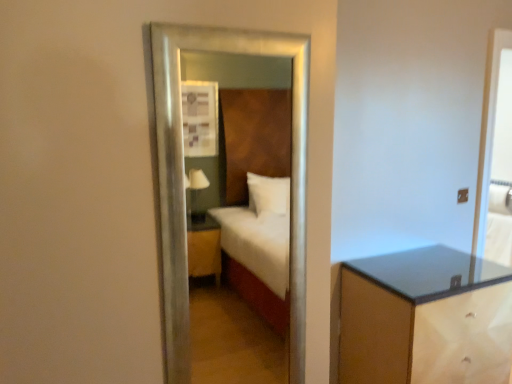
Question: Does clear glass screen door at right have a greater height compared to matte brown nightstand at lower right?

Choices:
 (A) no
 (B) yes

Answer: (B)

Question: Is clear glass screen door at right positioned far away from matte brown nightstand at lower right?

Choices:
 (A) yes
 (B) no

Answer: (B)

Question: Is clear glass screen door at right turned away from matte brown nightstand at lower right?

Choices:
 (A) yes
 (B) no

Answer: (B)

Question: Is the position of clear glass screen door at right less distant than that of matte brown nightstand at lower right?

Choices:
 (A) no
 (B) yes

Answer: (A)

Question: From the image's perspective, is clear glass screen door at right located above matte brown nightstand at lower right?

Choices:
 (A) no
 (B) yes

Answer: (B)

Question: In the image, is clear glass screen door at right positioned in front of or behind silver metallic mirror at center?

Choices:
 (A) front
 (B) behind

Answer: (B)

Question: From a real-world perspective, is clear glass screen door at right physically located above or below silver metallic mirror at center?

Choices:
 (A) below
 (B) above

Answer: (B)

Question: Is clear glass screen door at right inside the boundaries of silver metallic mirror at center, or outside?

Choices:
 (A) outside
 (B) inside

Answer: (A)

Question: Based on their positions, is clear glass screen door at right located to the left or right of silver metallic mirror at center?

Choices:
 (A) left
 (B) right

Answer: (B)

Question: From their relative heights in the image, would you say clear glass screen door at right is taller or shorter than matte brown nightstand at lower right?

Choices:
 (A) short
 (B) tall

Answer: (B)

Question: Does point (500, 153) appear closer or farther from the camera than point (492, 269)?

Choices:
 (A) farther
 (B) closer

Answer: (A)

Question: From a real-world perspective, is clear glass screen door at right positioned above or below matte brown nightstand at lower right?

Choices:
 (A) below
 (B) above

Answer: (B)

Question: Considering the relative positions of clear glass screen door at right and matte brown nightstand at lower right in the image provided, is clear glass screen door at right to the left or to the right of matte brown nightstand at lower right?

Choices:
 (A) right
 (B) left

Answer: (A)

Question: From a real-world perspective, is silver metallic mirror at center positioned above or below matte brown nightstand at lower right?

Choices:
 (A) below
 (B) above

Answer: (B)

Question: Is silver metallic mirror at center situated inside matte brown nightstand at lower right or outside?

Choices:
 (A) outside
 (B) inside

Answer: (A)